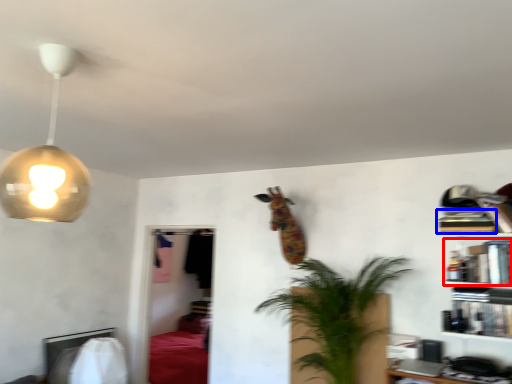
Question: Among these objects, which one is nearest to the camera, book (highlighted by a red box) or book (highlighted by a blue box)?

Choices:
 (A) book
 (B) book

Answer: (A)